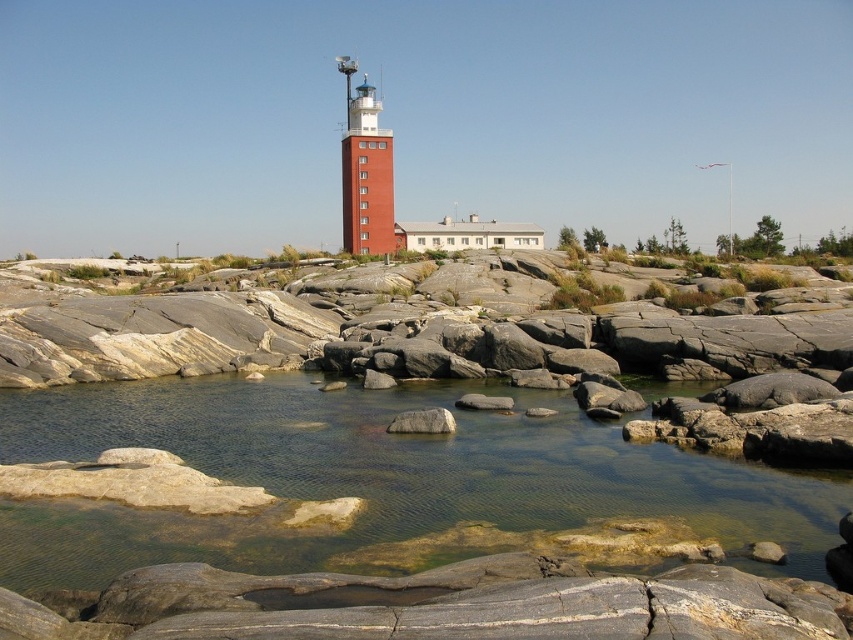
You are a hiker who wants to cross from the left side to the right side of the gray rock at center without getting your shoes wet. Is there a dry path available around the clear water at center?

The clear water at center is in front of the gray rock at center, so there is a dry path behind the gray rock at center that you can take to avoid getting your shoes wet.